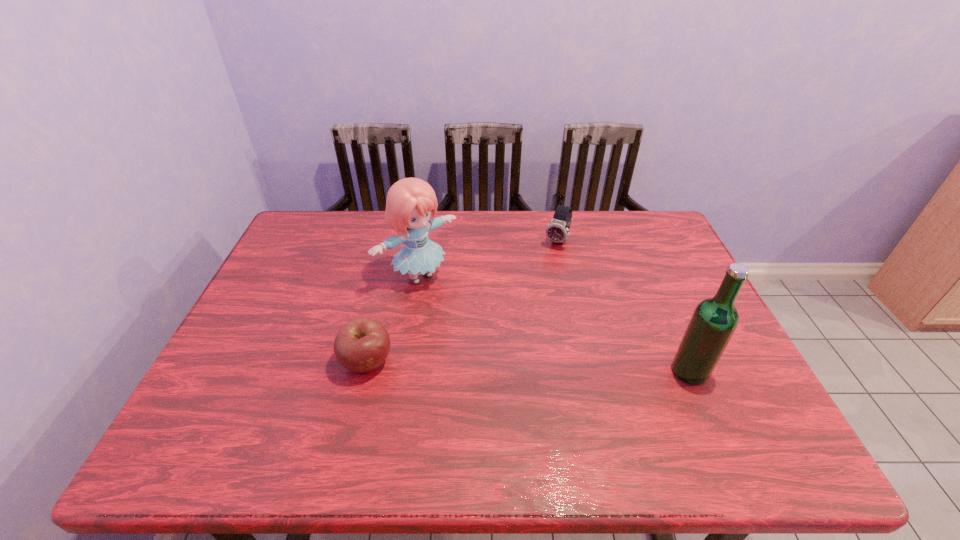
I want to click on apple, so click(362, 345).

Where is `the rightmost object`? This screenshot has height=540, width=960. the rightmost object is located at coordinates (714, 321).

Locate an element on the screen. The image size is (960, 540). the second object from right to left is located at coordinates (557, 231).

Locate an element on the screen. This screenshot has width=960, height=540. the third tallest object is located at coordinates (557, 231).

Find the location of a particular element. The width and height of the screenshot is (960, 540). doll is located at coordinates (409, 203).

Identify the location of free region located 0.080m on the side of the apple with the unique marking. (354, 415).

Locate an element on the screen. Image resolution: width=960 pixels, height=540 pixels. free space located 0.140m on the left of the rightmost object is located at coordinates (612, 371).

Identify the location of vacant point located 0.070m on the face of the third tallest object. The width and height of the screenshot is (960, 540). (546, 264).

Where is `free point located 0.340m on the face of the third tallest object`? The image size is (960, 540). free point located 0.340m on the face of the third tallest object is located at coordinates (513, 322).

At what (x,y) coordinates should I click in order to perform the action: click on vacant space located 0.360m on the face of the third tallest object. Please return your answer as a coordinate pair (x, y). Looking at the image, I should click on (510, 327).